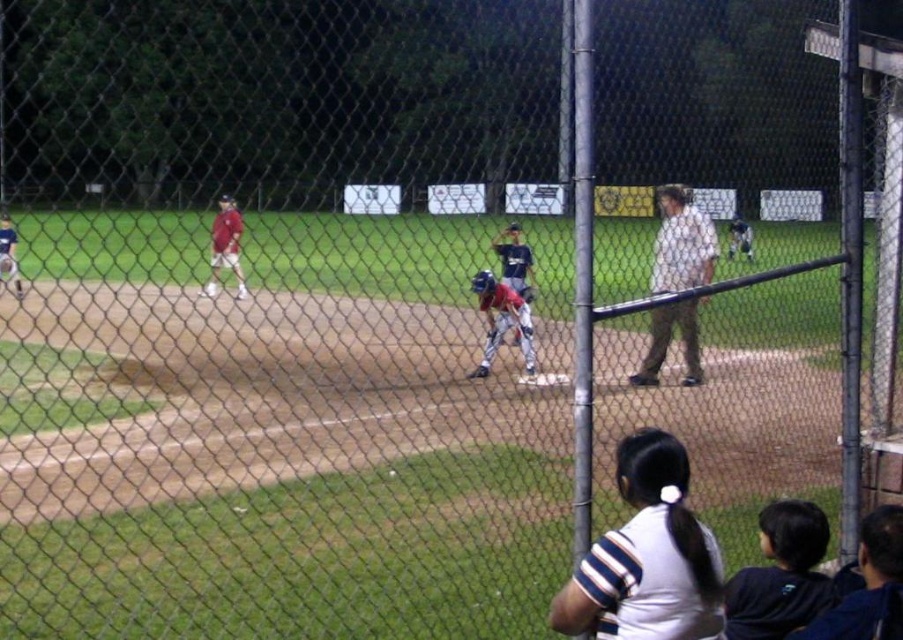
What do you see at coordinates (780, 573) in the screenshot?
I see `dark blue shirt at lower right` at bounding box center [780, 573].

I want to click on dark blue shirt at lower right, so click(780, 573).

Is point (812, 586) farther from viewer compared to point (500, 326)?

No, it is not.

Locate an element on the screen. Image resolution: width=903 pixels, height=640 pixels. dark blue shirt at lower right is located at coordinates (780, 573).

Find the location of a particular element. Image resolution: width=903 pixels, height=640 pixels. light brown cotton shirt at center is located at coordinates click(681, 243).

Image resolution: width=903 pixels, height=640 pixels. I want to click on light brown cotton shirt at center, so click(681, 243).

Who is positioned more to the left, blue matte helmet at center or matte red baseball uniform at left?

Positioned to the left is matte red baseball uniform at left.

Between point (473, 376) and point (212, 257), which one is positioned in front?

Positioned in front is point (473, 376).

Locate an element on the screen. This screenshot has height=640, width=903. blue matte helmet at center is located at coordinates (501, 321).

Identify the location of blue matte helmet at center. (501, 321).